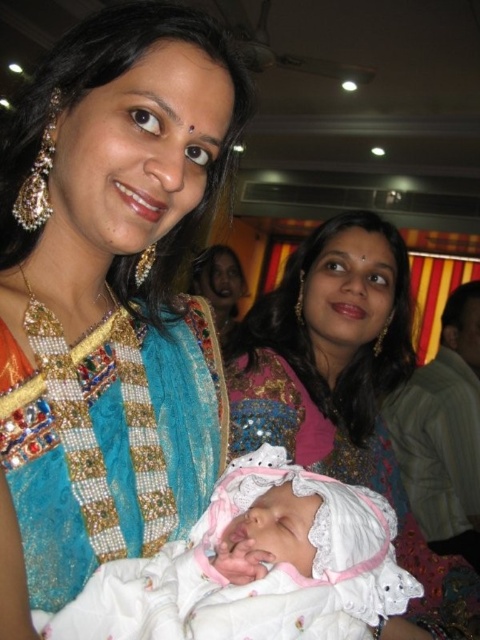
Question: Which object is positioned closest to the white lace cloth at center?

Choices:
 (A) matte pink fabric at center
 (B) matte blue fabric at center

Answer: (B)

Question: Which object is positioned closest to the matte gold necklace at center?

Choices:
 (A) matte blue fabric at center
 (B) matte pink fabric at center

Answer: (B)

Question: Is matte pink fabric at center to the right of white lace cloth at center from the viewer's perspective?

Choices:
 (A) yes
 (B) no

Answer: (A)

Question: Estimate the real-world distances between objects in this image. Which object is farther from the matte pink fabric at center?

Choices:
 (A) matte gold necklace at center
 (B) matte blue fabric at center
 (C) white lace cloth at center
 (D) turquoise beaded fabric dress at center

Answer: (A)

Question: Does matte blue fabric at center appear on the right side of white lace cloth at center?

Choices:
 (A) no
 (B) yes

Answer: (A)

Question: Can you confirm if turquoise beaded fabric dress at center is wider than matte gold necklace at center?

Choices:
 (A) no
 (B) yes

Answer: (A)